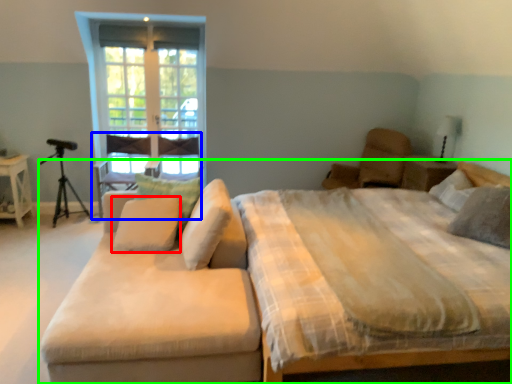
Question: Which is farther away from pillow (highlighted by a red box)? armchair (highlighted by a blue box) or bed (highlighted by a green box)?

Choices:
 (A) armchair
 (B) bed

Answer: (A)